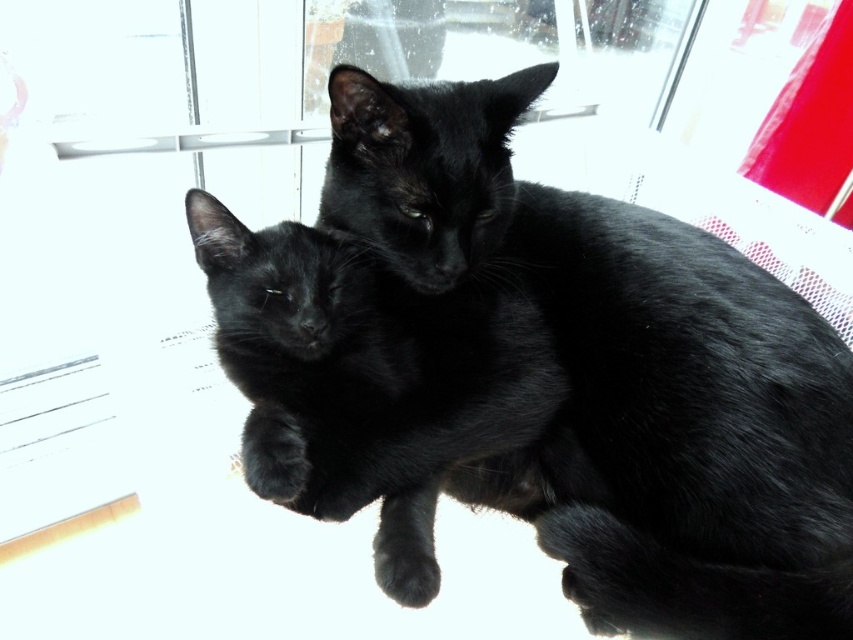
You are trying to locate two specific points in the image. The first point is at coordinate point (676, 252) and the second is at point (252, 458). From the observer perspective, which point is closer to the front?

Point (252, 458) is closer to the front because point (676, 252) is behind it.

You are a photographer trying to capture the black fur cat at center and the black fur paw at lower left in a single shot. Which one will appear closer to the camera in the photo?

The black fur cat at center will appear closer to the camera in the photo because it is in front of the black fur paw at lower left.